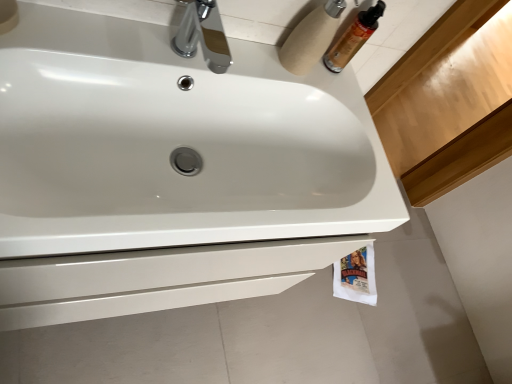
Image resolution: width=512 pixels, height=384 pixels. I want to click on free space to the left of chrome metallic faucet at upper center, so click(x=105, y=21).